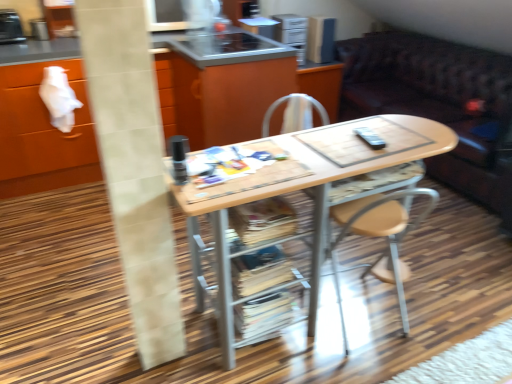
Question: Is metallic stainless steel toaster at upper left, placed as the third appliance when sorted from back to front, looking in the opposite direction of wooden cabinet at center?

Choices:
 (A) no
 (B) yes

Answer: (A)

Question: From the image's perspective, is metallic stainless steel toaster at upper left, which is counted as the 1th appliance, starting from the front, above wooden cabinet at center?

Choices:
 (A) no
 (B) yes

Answer: (B)

Question: Could you tell me if metallic stainless steel toaster at upper left, which is counted as the 1th appliance, starting from the front, is turned towards wooden cabinet at center?

Choices:
 (A) yes
 (B) no

Answer: (B)

Question: Does metallic stainless steel toaster at upper left, which is counted as the 1th appliance, starting from the front, have a greater height compared to wooden cabinet at center?

Choices:
 (A) no
 (B) yes

Answer: (A)

Question: Would you say metallic stainless steel toaster at upper left, the first appliance in the left-to-right sequence, is outside wooden cabinet at center?

Choices:
 (A) no
 (B) yes

Answer: (B)

Question: Based on their positions, is metallic silver microwave at upper center, acting as the second appliance starting from the front, located to the left or right of metallic stainless steel toaster at upper left, arranged as the 3th appliance when viewed from the right?

Choices:
 (A) left
 (B) right

Answer: (B)

Question: From the image's perspective, is metallic silver microwave at upper center, which is the second appliance in back-to-front order, located above or below metallic stainless steel toaster at upper left, arranged as the 3th appliance when viewed from the right?

Choices:
 (A) below
 (B) above

Answer: (B)

Question: In terms of width, does metallic silver microwave at upper center, acting as the second appliance starting from the front, look wider or thinner when compared to metallic stainless steel toaster at upper left, which is counted as the 1th appliance, starting from the front?

Choices:
 (A) wide
 (B) thin

Answer: (B)

Question: Looking at the image, does metallic silver microwave at upper center, which is the second appliance in back-to-front order, seem bigger or smaller compared to metallic stainless steel toaster at upper left, which is counted as the 1th appliance, starting from the front?

Choices:
 (A) big
 (B) small

Answer: (B)

Question: From the image's perspective, is wooden/matte desk at center located above or below wooden cabinet at center?

Choices:
 (A) below
 (B) above

Answer: (A)

Question: Is wooden/matte desk at center taller or shorter than wooden cabinet at center?

Choices:
 (A) tall
 (B) short

Answer: (B)

Question: Looking at the image, does wooden/matte desk at center seem bigger or smaller compared to wooden cabinet at center?

Choices:
 (A) small
 (B) big

Answer: (A)

Question: In terms of width, does wooden/matte desk at center look wider or thinner when compared to wooden cabinet at center?

Choices:
 (A) wide
 (B) thin

Answer: (B)

Question: Considering the positions of metallic stainless steel toaster at upper left, placed as the third appliance when sorted from back to front, and metallic silver microwave at upper center, which is the second appliance in back-to-front order, in the image, is metallic stainless steel toaster at upper left, placed as the third appliance when sorted from back to front, taller or shorter than metallic silver microwave at upper center, which is the second appliance in back-to-front order,?

Choices:
 (A) short
 (B) tall

Answer: (B)

Question: Is metallic stainless steel toaster at upper left, placed as the third appliance when sorted from back to front, inside the boundaries of metallic silver microwave at upper center, which is the second appliance in back-to-front order, or outside?

Choices:
 (A) outside
 (B) inside

Answer: (A)